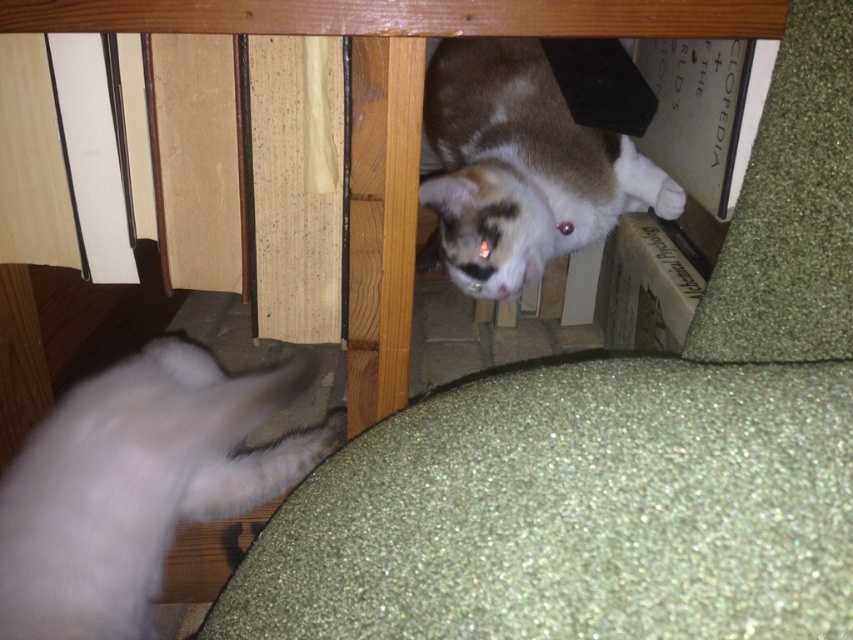
Who is more distant from viewer, (206, 440) or (437, 104)?

Positioned behind is point (437, 104).

Does white fluffy cat at lower left have a lesser height compared to calico fur cat at upper center?

Yes.

Who is more forward, (213, 480) or (601, 147)?

Positioned in front is point (213, 480).

The image size is (853, 640). Find the location of `white fluffy cat at lower left`. white fluffy cat at lower left is located at coordinates (138, 484).